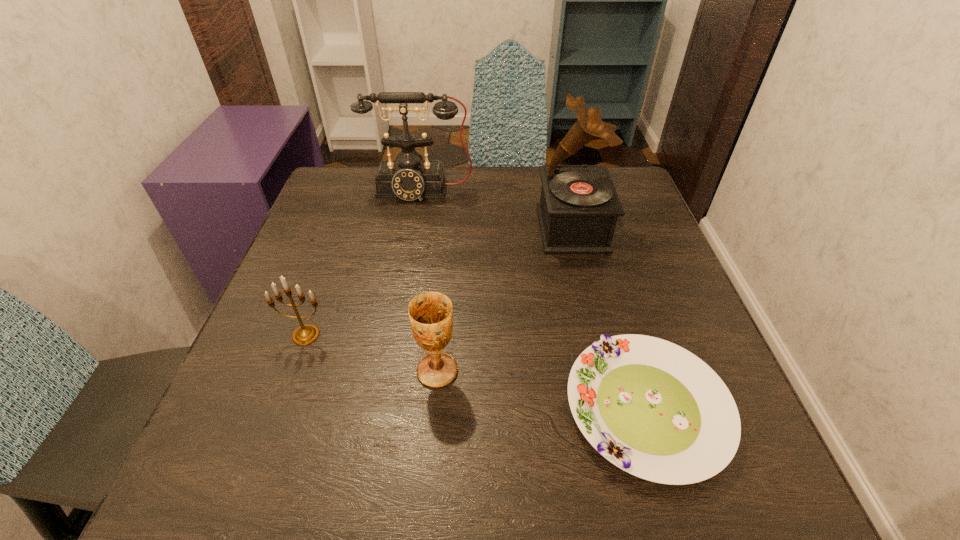
You are a GUI agent. You are given a task and a screenshot of the screen. Output one action in this format:
    pyautogui.click(x=<x>, y=<y>)
    Task: Click on the object that is the second closest to the candelabrum
    
    Given the screenshot: What is the action you would take?
    pyautogui.click(x=409, y=177)

You are a GUI agent. You are given a task and a screenshot of the screen. Output one action in this format:
    pyautogui.click(x=<x>, y=<y>)
    Task: Click on the vacant region that satisfies the following two spatial constraints: 1. at the horn opening of the shortest object; 2. on the right side of the fourth nearest object
    This screenshot has width=960, height=540.
    Given the screenshot: What is the action you would take?
    pyautogui.click(x=616, y=409)

This screenshot has height=540, width=960. What are the coordinates of `blank space that satisfies the following two spatial constraints: 1. on the dial of the farthest object; 2. on the right side of the chalice` in the screenshot? It's located at (387, 371).

Locate an element on the screen. free space that satisfies the following two spatial constraints: 1. on the dial of the shortest object; 2. on the right side of the fourth shortest object is located at coordinates (380, 409).

Identify the location of free space that satisfies the following two spatial constraints: 1. at the horn opening of the phonograph_record; 2. on the front side of the chalice. This screenshot has height=540, width=960. (607, 371).

At what (x,y) coordinates should I click in order to perform the action: click on vacant space that satisfies the following two spatial constraints: 1. at the horn opening of the second farthest object; 2. on the back side of the shortest object. Please return your answer as a coordinate pair (x, y). The height and width of the screenshot is (540, 960). Looking at the image, I should click on (616, 409).

At what (x,y) coordinates should I click in order to perform the action: click on vacant area in the image that satisfies the following two spatial constraints: 1. at the horn opening of the phonograph_record; 2. on the left side of the shortest object. Please return your answer as a coordinate pair (x, y). Looking at the image, I should click on (616, 409).